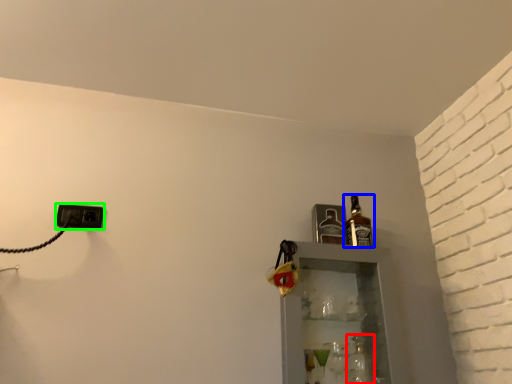
Question: Based on their relative distances, which object is nearer to bottle (highlighted by a red box)? Choose from bottle (highlighted by a blue box) and electric outlet (highlighted by a green box).

Choices:
 (A) bottle
 (B) electric outlet

Answer: (A)